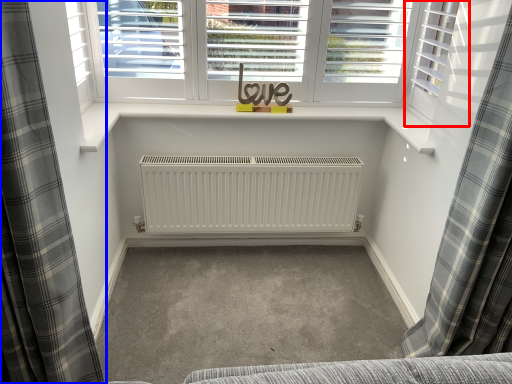
Question: Which of the following is the closest to the observer, shutter (highlighted by a red box) or curtain (highlighted by a blue box)?

Choices:
 (A) shutter
 (B) curtain

Answer: (B)